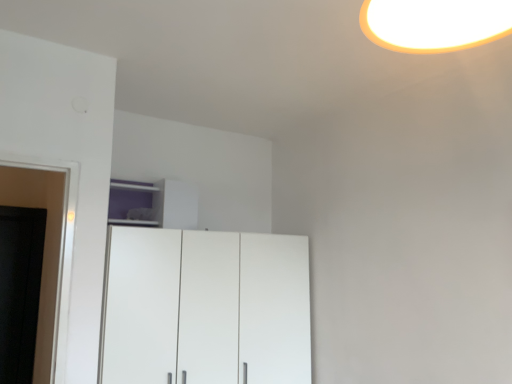
Question: From a real-world perspective, is purple matte cabinet at upper center physically located above or below white glossy cupboard at center?

Choices:
 (A) above
 (B) below

Answer: (A)

Question: In the image, is purple matte cabinet at upper center on the left side or the right side of white glossy cupboard at center?

Choices:
 (A) left
 (B) right

Answer: (A)

Question: In terms of size, does purple matte cabinet at upper center appear bigger or smaller than white glossy cupboard at center?

Choices:
 (A) big
 (B) small

Answer: (B)

Question: Is white glossy cupboard at center wider or thinner than purple matte cabinet at upper center?

Choices:
 (A) thin
 (B) wide

Answer: (B)

Question: From their relative heights in the image, would you say white glossy cupboard at center is taller or shorter than purple matte cabinet at upper center?

Choices:
 (A) short
 (B) tall

Answer: (B)

Question: Based on their positions, is white glossy cupboard at center located to the left or right of purple matte cabinet at upper center?

Choices:
 (A) left
 (B) right

Answer: (B)

Question: From the image's perspective, is white glossy cupboard at center located above or below purple matte cabinet at upper center?

Choices:
 (A) above
 (B) below

Answer: (B)